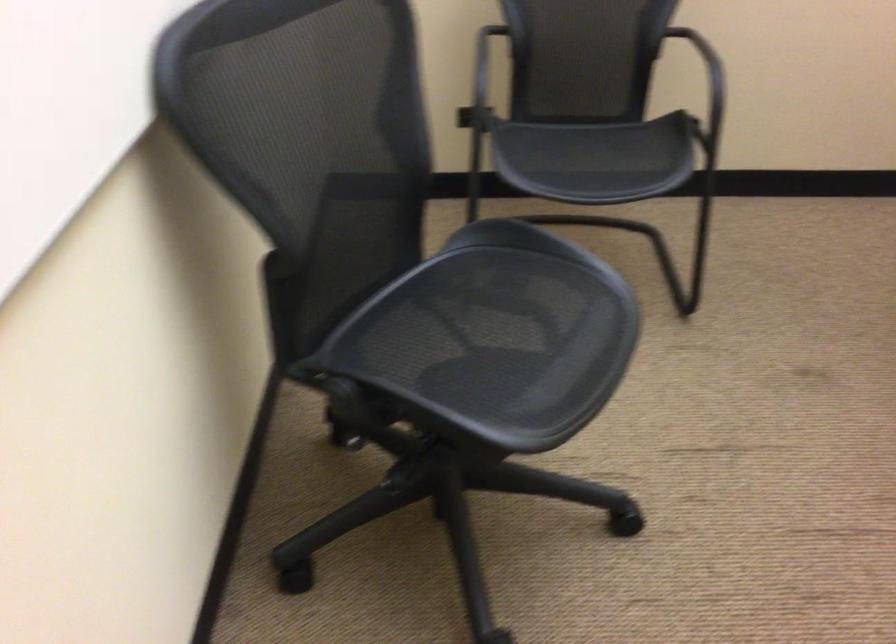
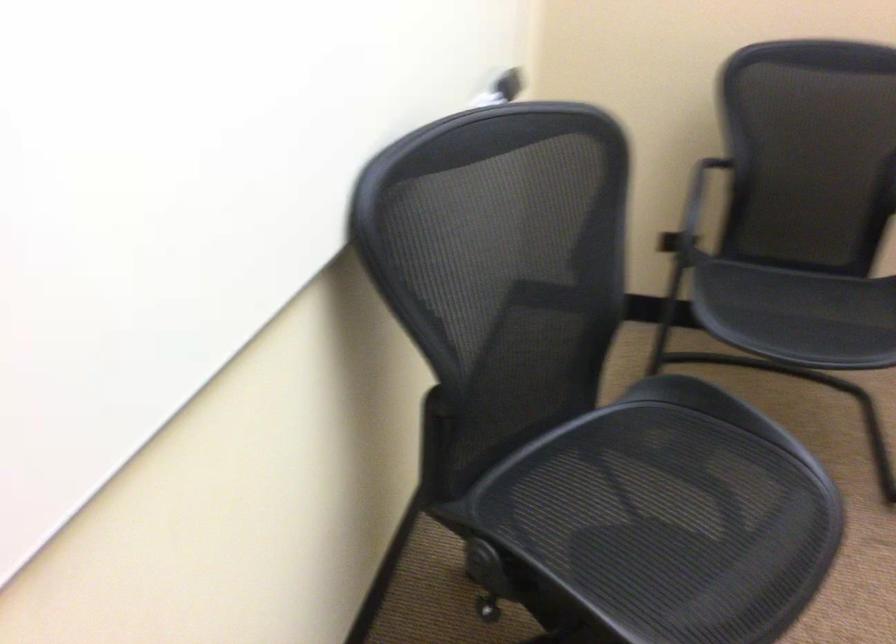
Where in the second image is the point corresponding to pixel 467 330 from the first image?

(634, 502)